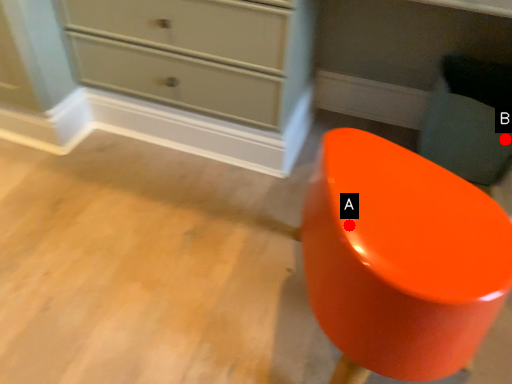
Question: Two points are circled on the image, labeled by A and B beside each circle. Which point is closer to the camera?

Choices:
 (A) A is closer
 (B) B is closer

Answer: (A)